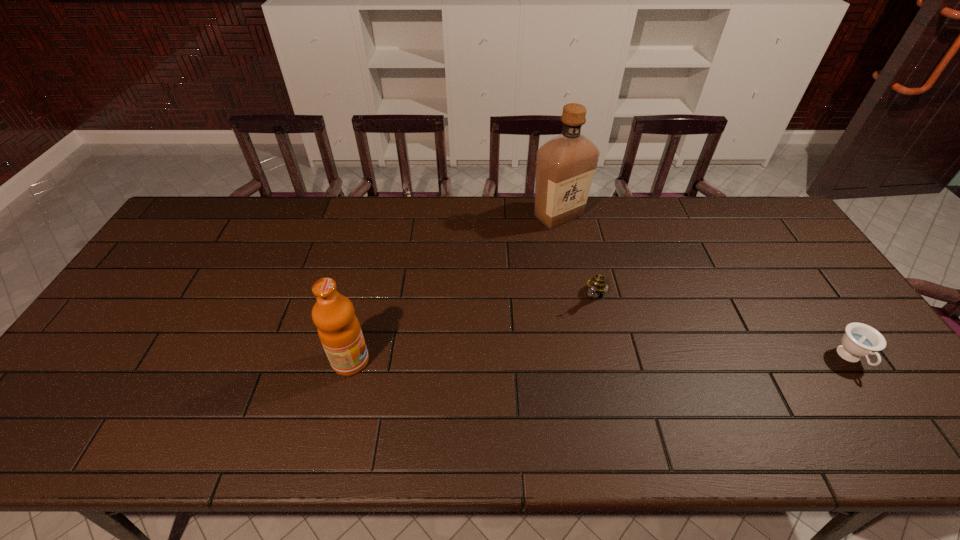
Locate an element on the screen. vacant space on the desktop that is between the third shortest object and the rightmost object and is positioned on the face of the third nearest object is located at coordinates (562, 360).

Image resolution: width=960 pixels, height=540 pixels. Identify the location of free space on the desktop that is between the leftmost object and the shortest object and is positioned on the front-facing side of the liquor. (584, 360).